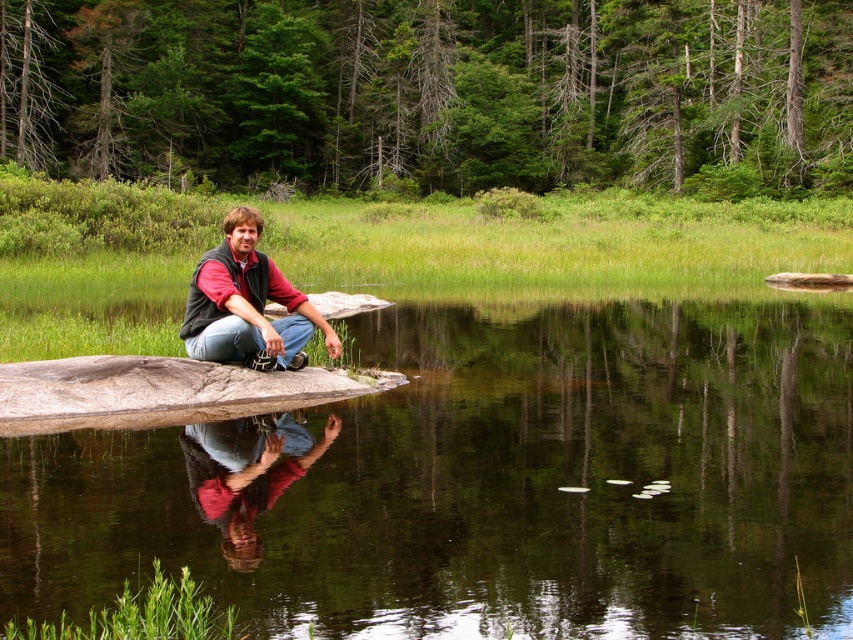
Question: Does transparent water at center have a larger size compared to matte black vest at center?

Choices:
 (A) yes
 (B) no

Answer: (A)

Question: Which of the following is the farthest from the observer?

Choices:
 (A) transparent water at center
 (B) matte black vest at center

Answer: (B)

Question: Is transparent water at center to the left of matte black vest at center from the viewer's perspective?

Choices:
 (A) no
 (B) yes

Answer: (A)

Question: Which point is closer to the camera?

Choices:
 (A) (229, 282)
 (B) (253, 557)

Answer: (B)

Question: Can you confirm if transparent water at center is positioned to the left of matte black vest at center?

Choices:
 (A) no
 (B) yes

Answer: (A)